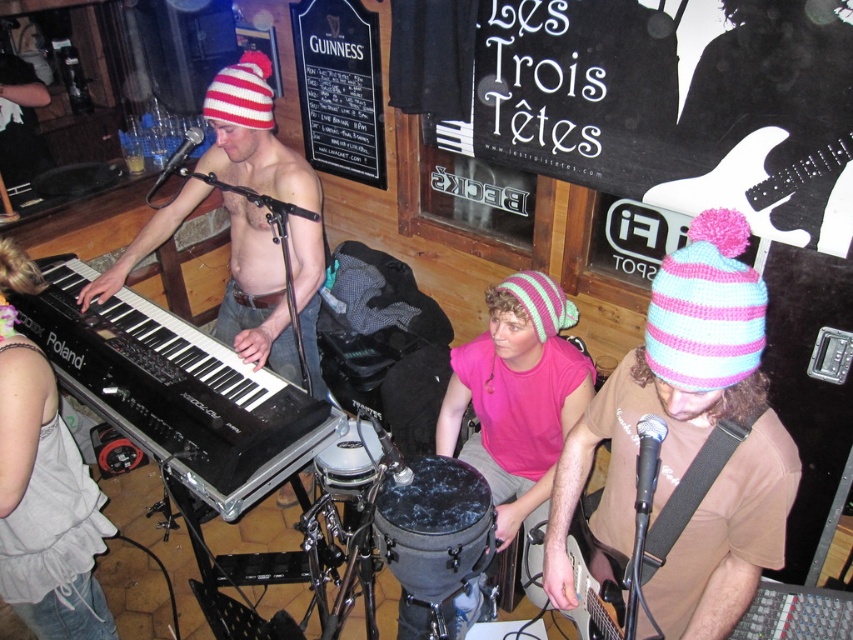
Does pink knit beanie at center have a lesser height compared to striped knit beanie at upper left?

No.

Between pink knit beanie at center and striped knit beanie at upper left, which one is positioned higher?

striped knit beanie at upper left is higher up.

In order to click on pink knit beanie at center in this screenshot , I will do `click(517, 397)`.

Identify the location of pink knit beanie at center. (517, 397).

Does point (680, 451) come farther from viewer compared to point (45, 557)?

No, it is not.

Between pink knitted hat at center and matte black keyboard at left, which one appears on the right side from the viewer's perspective?

Positioned to the right is pink knitted hat at center.

I want to click on pink knitted hat at center, so click(688, 438).

Which of these two, pink knit beanie at center or pink and light blue knitted beanie at right, stands taller?

pink knit beanie at center

Is point (538, 484) positioned before point (761, 296)?

No, it is behind (761, 296).

Find the location of `pink knit beanie at center`. pink knit beanie at center is located at coordinates (517, 397).

You are a GUI agent. You are given a task and a screenshot of the screen. Output one action in this format:
    pyautogui.click(x=<x>, y=<y>)
    Task: Click on the pink knit beanie at center
    The height and width of the screenshot is (640, 853).
    Given the screenshot: What is the action you would take?
    pyautogui.click(x=517, y=397)